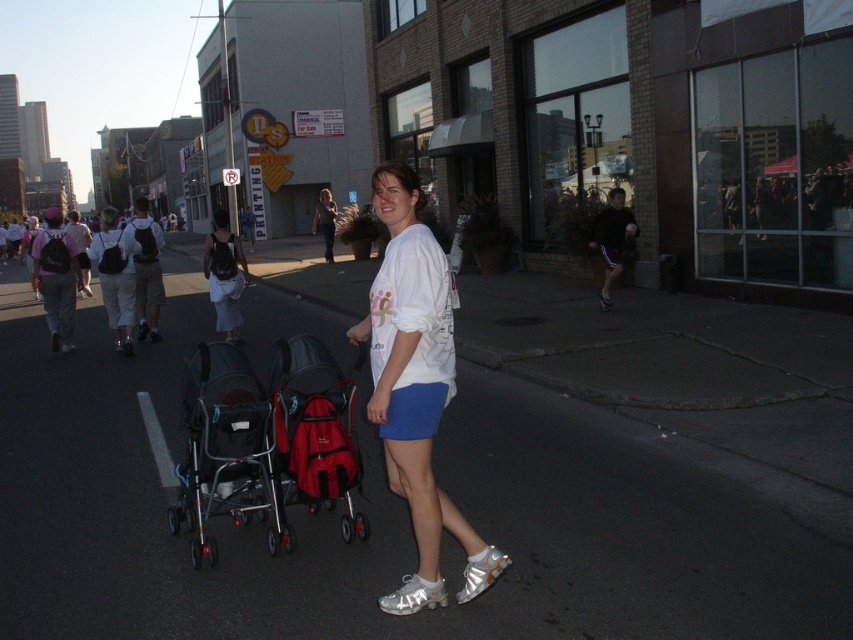
Question: Which point is farther to the camera?

Choices:
 (A) silver metallic stroller at center-left
 (B) matte white t-shirt at center
 (C) white cotton t-shirt at center
 (D) light beige backpack at left

Answer: (B)

Question: Which object is the farthest from the silver metallic stroller at center-left?

Choices:
 (A) matte white t-shirt at center
 (B) dark asphalt pavement at center
 (C) white cotton t-shirt at center

Answer: (A)

Question: Can you confirm if red fabric stroller at center is bigger than white cotton shirt at center?

Choices:
 (A) yes
 (B) no

Answer: (B)

Question: Considering the real-world distances, which object is closest to the matte white t-shirt at center?

Choices:
 (A) silver metallic stroller at center-left
 (B) white cotton t-shirt at center

Answer: (A)

Question: Can you confirm if silver metallic stroller at center-left is positioned above red fabric stroller at center?

Choices:
 (A) yes
 (B) no

Answer: (B)

Question: In this image, where is white cotton shirt at center located relative to matte white t-shirt at center?

Choices:
 (A) left
 (B) right

Answer: (A)